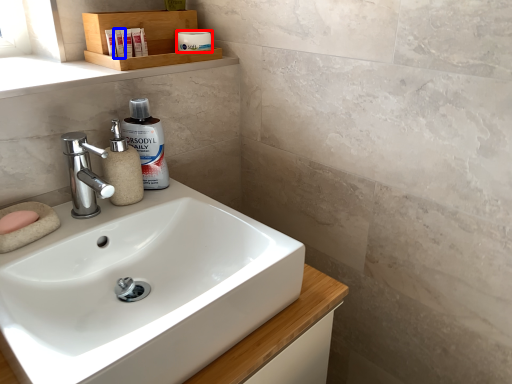
Question: Among these objects, which one is farthest to the camera, toiletry (highlighted by a red box) or toiletry (highlighted by a blue box)?

Choices:
 (A) toiletry
 (B) toiletry

Answer: (A)